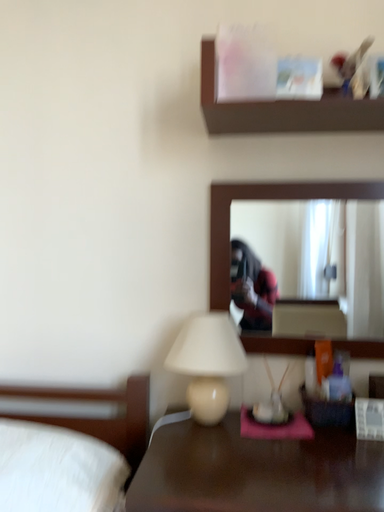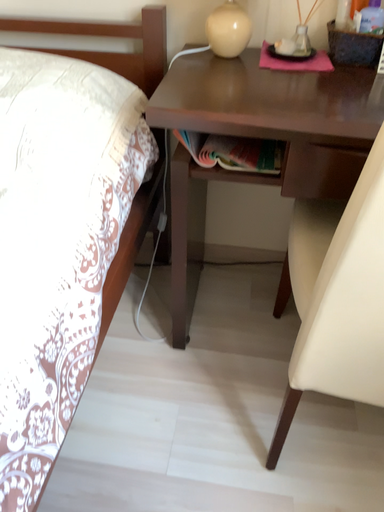
Question: Which way did the camera rotate in the video?

Choices:
 (A) rotated downward
 (B) rotated upward

Answer: (A)